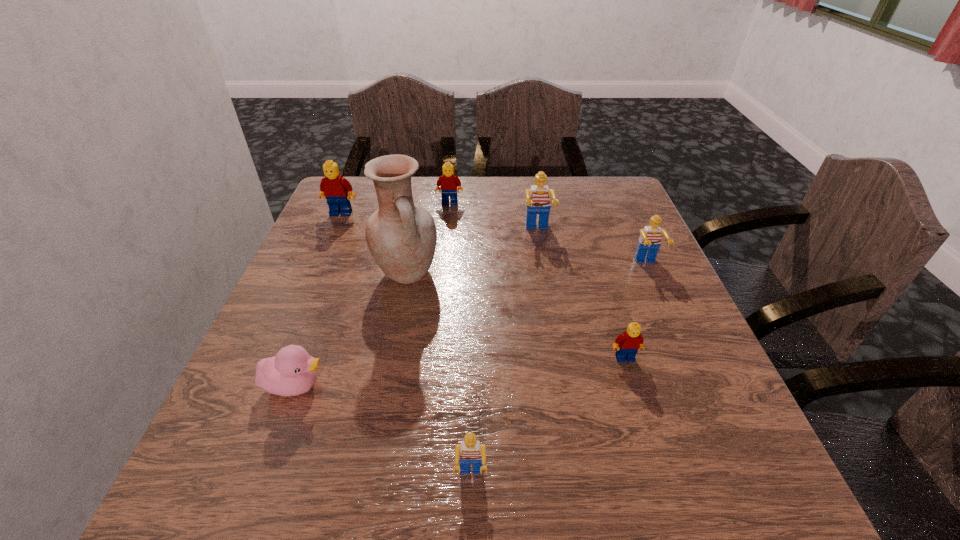
This screenshot has width=960, height=540. I want to click on the tallest object, so click(x=401, y=236).

Image resolution: width=960 pixels, height=540 pixels. What are the coordinates of `pink pottery` in the screenshot? It's located at (401, 236).

You are a GUI agent. You are given a task and a screenshot of the screen. Output one action in this format:
    pyautogui.click(x=<x>, y=<y>)
    Task: Click on the third farthest object
    
    Given the screenshot: What is the action you would take?
    pyautogui.click(x=538, y=201)

I want to click on the biggest blue Lego, so click(x=538, y=201).

Image resolution: width=960 pixels, height=540 pixels. Find the location of `the second farthest Lego`. the second farthest Lego is located at coordinates (334, 188).

Find the location of a particular element. The height and width of the screenshot is (540, 960). the leftmost yellow Lego is located at coordinates [334, 188].

At what (x,y) coordinates should I click in order to perform the action: click on the farthest Lego. Please return your answer as a coordinate pair (x, y). Looking at the image, I should click on (448, 181).

Identify the location of the second yellow Lego from left to right. Image resolution: width=960 pixels, height=540 pixels. (448, 181).

This screenshot has width=960, height=540. In order to click on the second smallest blue Lego in this screenshot , I will do `click(649, 242)`.

This screenshot has height=540, width=960. I want to click on the rightmost object, so click(649, 242).